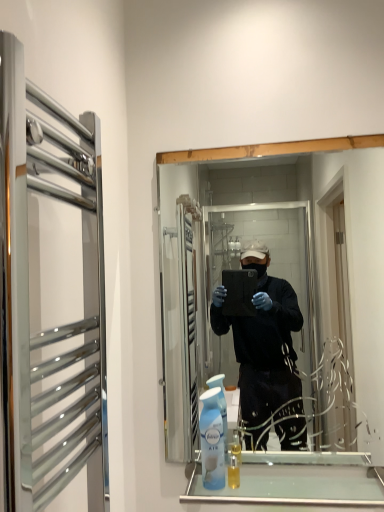
Question: From the image's perspective, is clear glass towel rack at left located above or below translucent plastic mouthwash at lower center?

Choices:
 (A) below
 (B) above

Answer: (B)

Question: In terms of height, does clear glass towel rack at left look taller or shorter compared to translucent plastic mouthwash at lower center?

Choices:
 (A) tall
 (B) short

Answer: (A)

Question: Estimate the real-world distances between objects in this image. Which object is closer to the clear glass cabinet at lower center?

Choices:
 (A) clear glass towel rack at left
 (B) light blue plastic air freshener at lower center
 (C) clear glass mirror at center
 (D) translucent plastic mouthwash at lower center

Answer: (B)

Question: Which of these objects is positioned closest to the clear glass cabinet at lower center?

Choices:
 (A) translucent plastic mouthwash at lower center
 (B) clear glass towel rack at left
 (C) light blue plastic air freshener at lower center
 (D) clear glass mirror at center

Answer: (C)